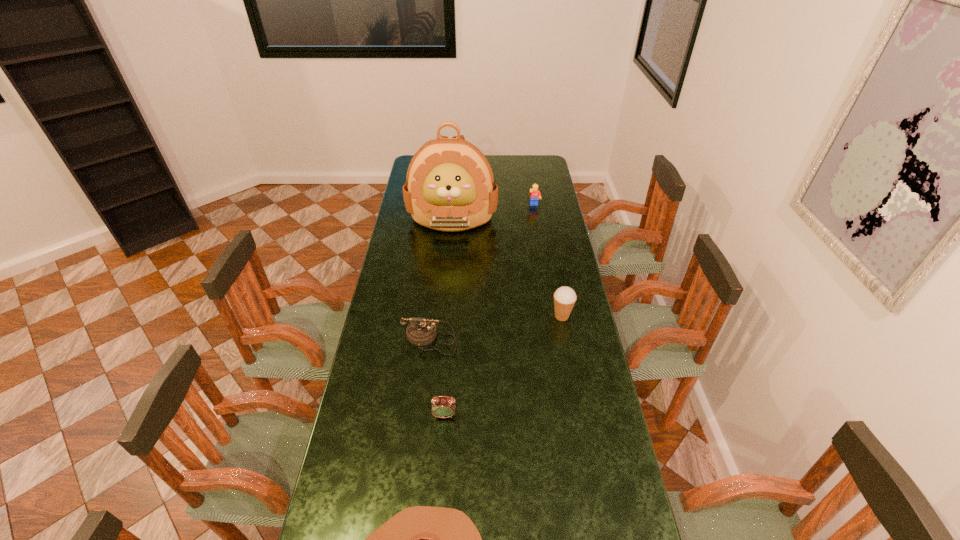
Where is `backpack`? backpack is located at coordinates (450, 186).

You are a GUI agent. You are given a task and a screenshot of the screen. Output one action in this format:
    pyautogui.click(x=<x>, y=<y>)
    Task: Click on the icecream
    
    Given the screenshot: What is the action you would take?
    pyautogui.click(x=565, y=297)

Identify the location of Lego. [535, 194].

Where is `telephone`? telephone is located at coordinates (421, 331).

Identify the location of the fifth farthest object. (442, 406).

Locate an element on the screen. The width and height of the screenshot is (960, 540). free space located 0.120m on the front-facing side of the tallest object is located at coordinates (449, 256).

Identify the location of free space located 0.100m on the back of the second tallest object. (557, 291).

Where is `blank space located 0.230m on the face of the Lego`? The width and height of the screenshot is (960, 540). blank space located 0.230m on the face of the Lego is located at coordinates (540, 235).

Find the location of a particular element. The image size is (960, 540). vacant region located on the back of the telephone is located at coordinates (439, 265).

Image resolution: width=960 pixels, height=540 pixels. What are the coordinates of `free space located on the face of the fifth farthest object` in the screenshot? It's located at (443, 442).